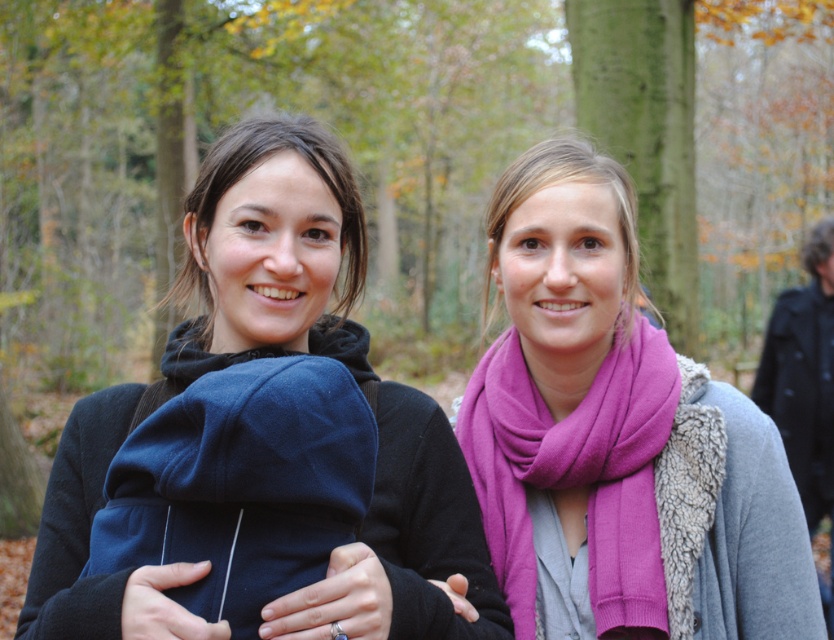
In the scene shown: Who is more forward, (548, 150) or (480, 403)?

Point (548, 150)

Between purple scarf at center and purple woolen scarf at center, which one has less height?

With less height is purple woolen scarf at center.

At what (x,y) coordinates should I click in order to perform the action: click on purple scarf at center. Please return your answer as a coordinate pair (x, y). Image resolution: width=834 pixels, height=640 pixels. Looking at the image, I should click on (616, 438).

Identify the location of purple scarf at center. (616, 438).

Is purple scarf at center to the left of matte black jacket at left from the viewer's perspective?

In fact, purple scarf at center is to the right of matte black jacket at left.

Looking at this image, who is more forward, (785, 620) or (297, 621)?

Point (297, 621) is in front.

Where is `purple scarf at center`? This screenshot has height=640, width=834. purple scarf at center is located at coordinates (616, 438).

Does matte black jacket at left appear on the left side of purple woolen scarf at center?

Correct, you'll find matte black jacket at left to the left of purple woolen scarf at center.

Between point (440, 538) and point (619, 339), which one is positioned behind?

Positioned behind is point (619, 339).

Locate an element on the screen. matte black jacket at left is located at coordinates (270, 252).